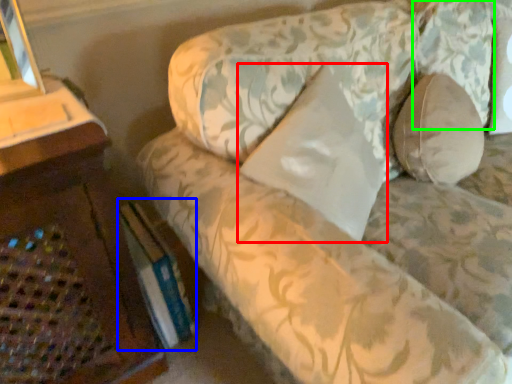
Question: Which object is the closest to the pillow (highlighted by a red box)? Choose among these: paperback book (highlighted by a blue box) or pillow (highlighted by a green box).

Choices:
 (A) paperback book
 (B) pillow

Answer: (A)